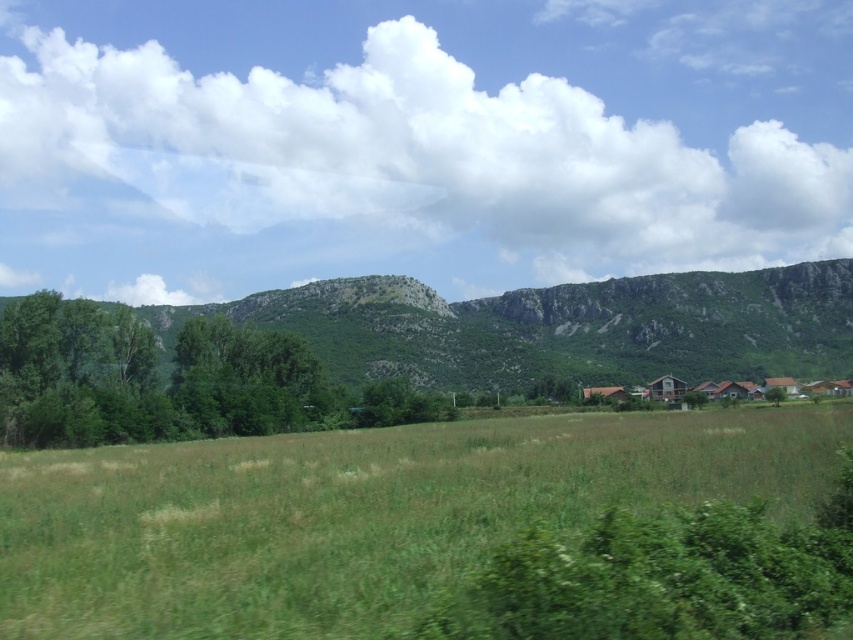
You are standing in the rural landscape and want to place a small flag at each of the two points labeled point [82,460] and point [248,308]. Which point will have its flag closer to your eyes?

Point [82,460] is closer to the camera than point [248,308], so the flag placed at point [82,460] will be closer to your eyes.